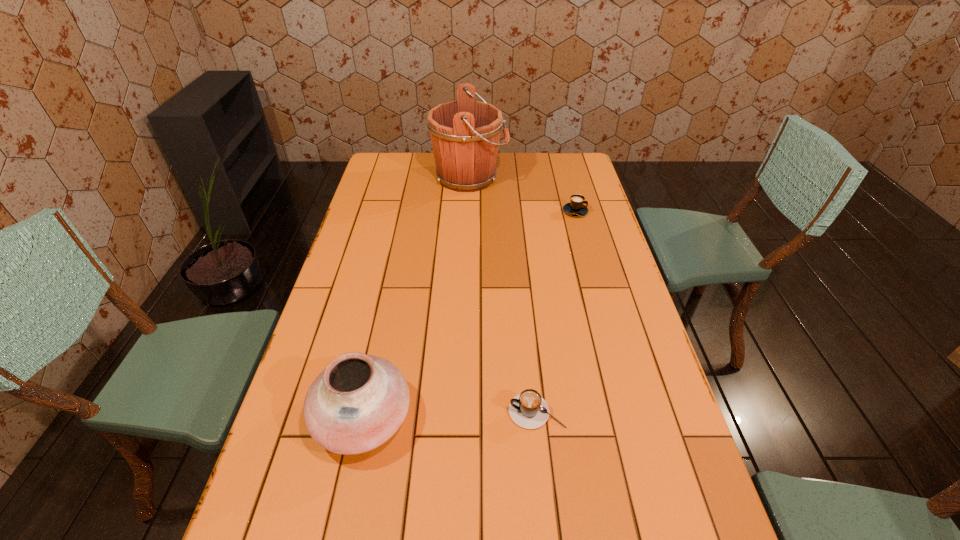
Find the location of a particular element. object that is the third closest to the rightmost object is located at coordinates (358, 402).

In order to click on free region that satisfies the following two spatial constraints: 1. with the handle on the side of the bucket; 2. on the left side of the right cappuccino in this screenshot , I will do coord(468,211).

Image resolution: width=960 pixels, height=540 pixels. I want to click on free space that satisfies the following two spatial constraints: 1. with the handle on the side of the tallest object; 2. on the back side of the rightmost object, so click(468, 211).

Locate an element on the screen. Image resolution: width=960 pixels, height=540 pixels. free space that satisfies the following two spatial constraints: 1. with the handle on the side of the right cappuccino; 2. on the left side of the tallest object is located at coordinates (468, 211).

Find the location of `vacant position in the image that satisfies the following two spatial constraints: 1. with the handle on the side of the bucket; 2. on the back side of the farther cappuccino`. vacant position in the image that satisfies the following two spatial constraints: 1. with the handle on the side of the bucket; 2. on the back side of the farther cappuccino is located at coordinates (468, 211).

This screenshot has width=960, height=540. Identify the location of vacant area in the image that satisfies the following two spatial constraints: 1. with the handle on the side of the bucket; 2. on the left side of the farther cappuccino. (468, 211).

Where is `vacant area in the image that satisfies the following two spatial constraints: 1. on the back side of the farther cappuccino; 2. with the handle on the side of the bucket`? This screenshot has width=960, height=540. vacant area in the image that satisfies the following two spatial constraints: 1. on the back side of the farther cappuccino; 2. with the handle on the side of the bucket is located at coordinates (566, 177).

What are the coordinates of `vacant area in the image that satisfies the following two spatial constraints: 1. with the handle on the side of the left cappuccino; 2. on the front side of the pottery` in the screenshot? It's located at [538, 417].